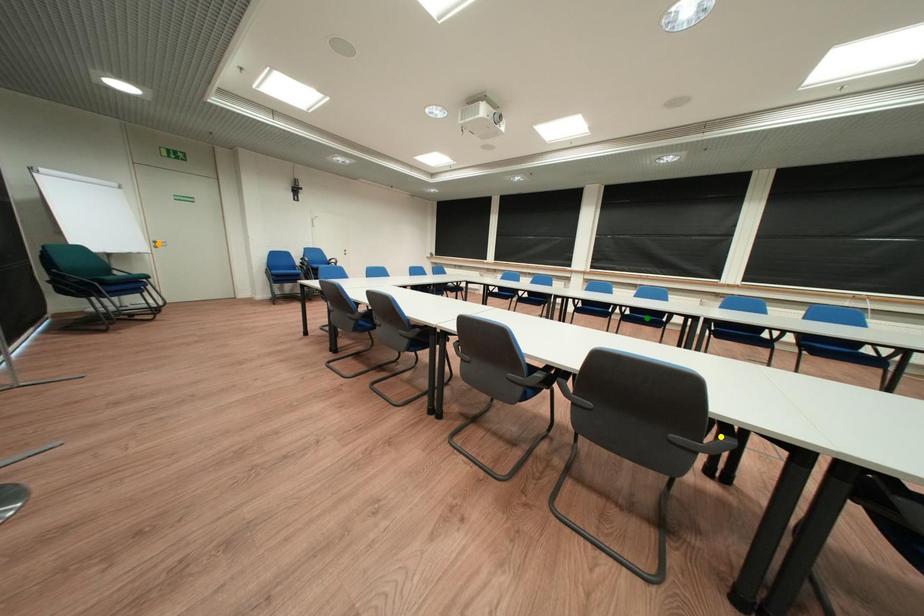
Order these from farthest to nearest:
1. yellow point
2. green point
3. orange point

orange point, green point, yellow point